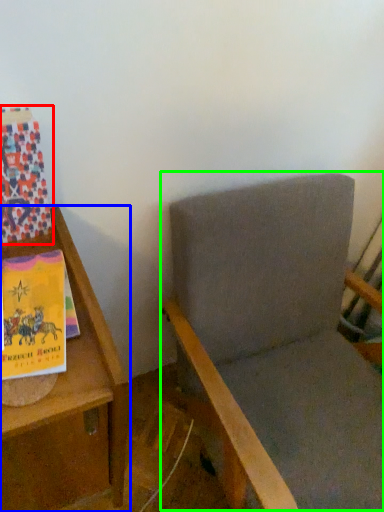
Question: Based on their relative distances, which object is farther from paperback book (highlighted by a red box)? Choose from furniture (highlighted by a blue box) and rocking chair (highlighted by a green box).

Choices:
 (A) furniture
 (B) rocking chair

Answer: (B)